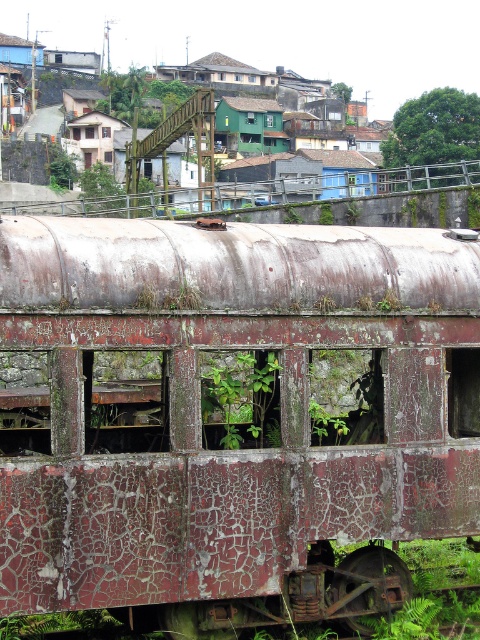
You are standing in front of the abandoned train carriage and want to determine the relative positions of two points marked on the carriage. Which point, point (315,291) or point (403,145), is closer to you?

Point (315,291) is closer to the camera than point (403,145), so it is closer to you.

In the scene shown: You are standing in front of an abandoned train carriage. You notice a specific point at coordinates (202, 420). What object is located at this point?

The point at coordinates (202, 420) indicates the rusty metal train at center.

You are standing at the point marked as point (240, 400) in the image. What do you see in front of you?

You see a green leafy plant at center in front of you.